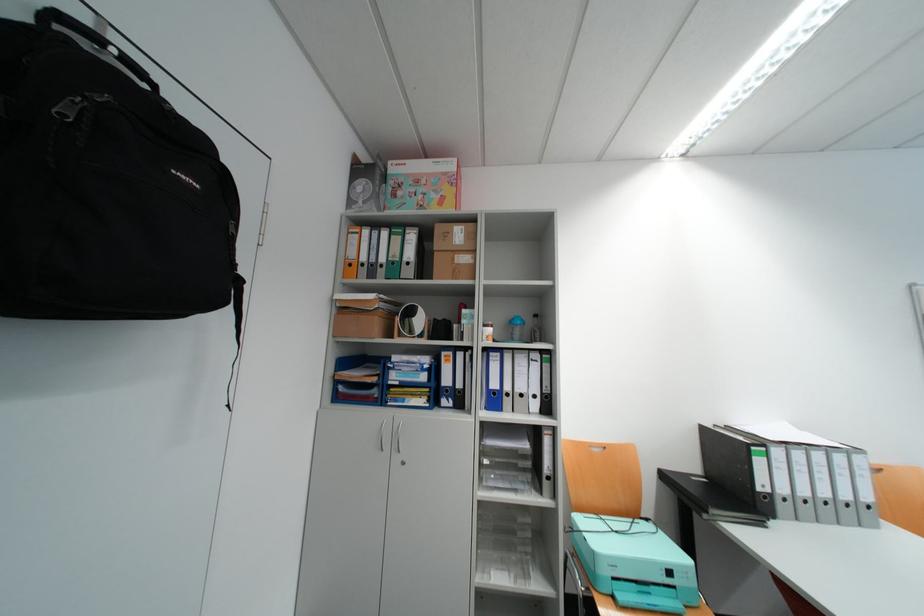
This screenshot has height=616, width=924. I want to click on silver cabinet handle, so click(x=382, y=435).